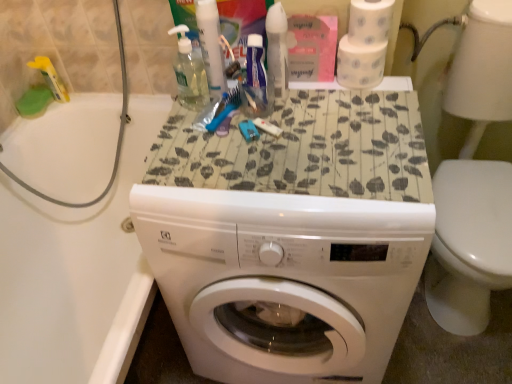
I want to click on vacant space in front of yellow plastic bottle at upper left, the 2th toiletry from the right, so click(x=34, y=121).